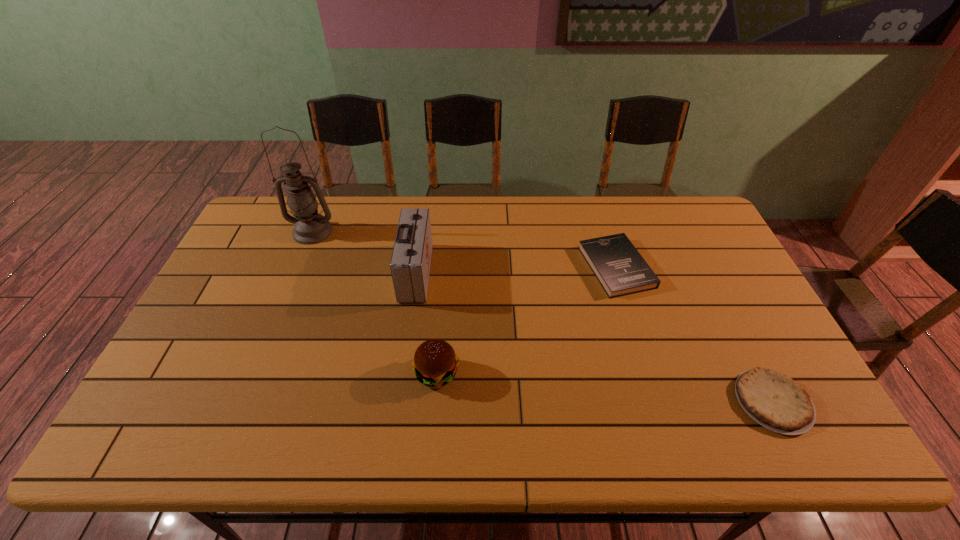
This screenshot has width=960, height=540. Identify the location of free region that satisfies the following two spatial constraints: 1. on the front-facing side of the second tallest object; 2. on the back side of the hamburger. click(402, 374).